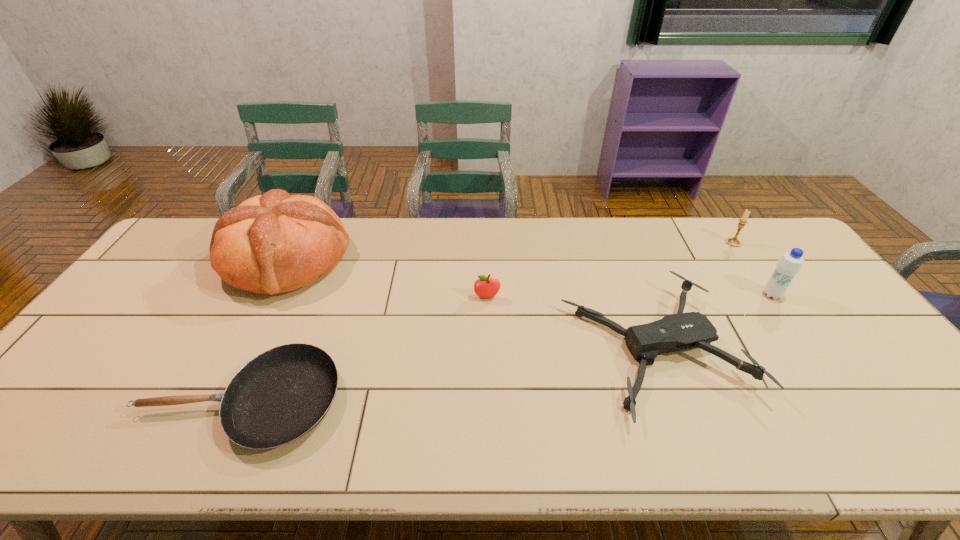
Locate an element on the screen. Image resolution: width=960 pixels, height=540 pixels. object that is at the far right corner is located at coordinates (734, 242).

What are the coordinates of `free space at the far edge of the desktop` in the screenshot? It's located at (632, 238).

You are a GUI agent. You are given a task and a screenshot of the screen. Output one action in this format:
    pyautogui.click(x=<x>, y=<y>)
    Task: Click on the vacant space at the near edge of the desktop
    
    Given the screenshot: What is the action you would take?
    pyautogui.click(x=411, y=444)

This screenshot has width=960, height=540. In order to click on vacant space at the right edge of the desktop in this screenshot , I will do `click(852, 397)`.

Image resolution: width=960 pixels, height=540 pixels. Find the location of `vacant space at the far left corner of the desktop`. vacant space at the far left corner of the desktop is located at coordinates (173, 246).

Where is `vacant space at the far right corner of the desktop`? The image size is (960, 540). vacant space at the far right corner of the desktop is located at coordinates (744, 238).

The width and height of the screenshot is (960, 540). Identify the location of vacant area that lies between the frying pan and the fourth shortest object. (487, 322).

Where is `free point between the fifth shortest object and the bread`? free point between the fifth shortest object and the bread is located at coordinates (529, 277).

At what (x,y) coordinates should I click in order to perform the action: click on free space between the third shortest object and the frying pan. Please return your answer as a coordinate pair (x, y). This screenshot has height=540, width=960. Looking at the image, I should click on (364, 349).

This screenshot has width=960, height=540. What are the coordinates of `vacant region between the third object from left to right and the frying pan` in the screenshot? It's located at (364, 349).